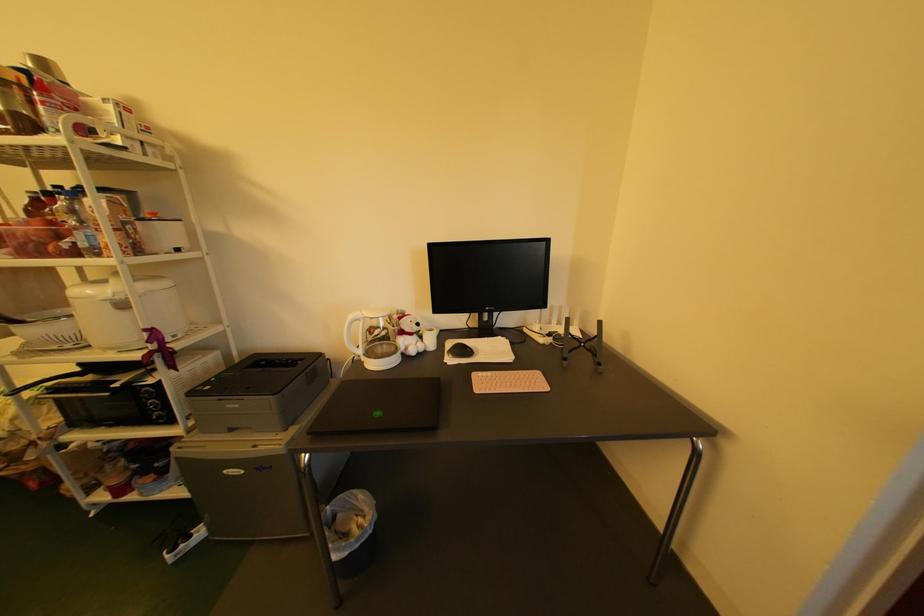
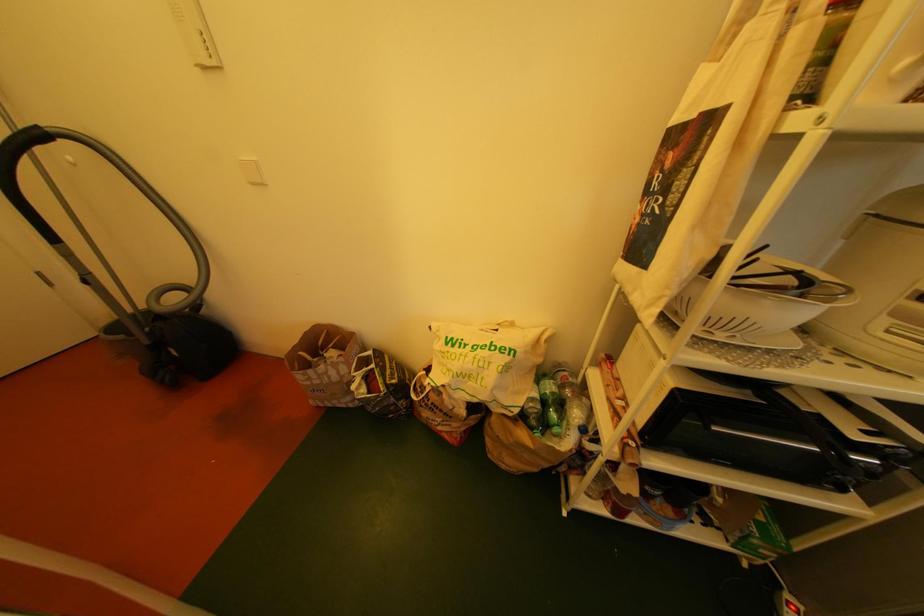
Question: In a continuous first-person perspective shot, in which direction is the camera moving?

Choices:
 (A) Left
 (B) Right
 (C) Forward
 (D) Backward

Answer: (A)